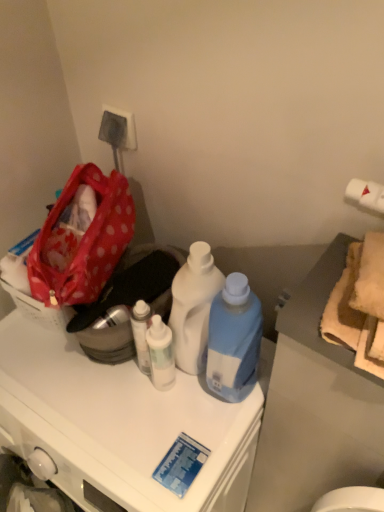
In order to click on vacant area situated to the left side of blue plastic bottle at center, the 1th bottle when ordered from right to left in this screenshot , I will do `click(152, 414)`.